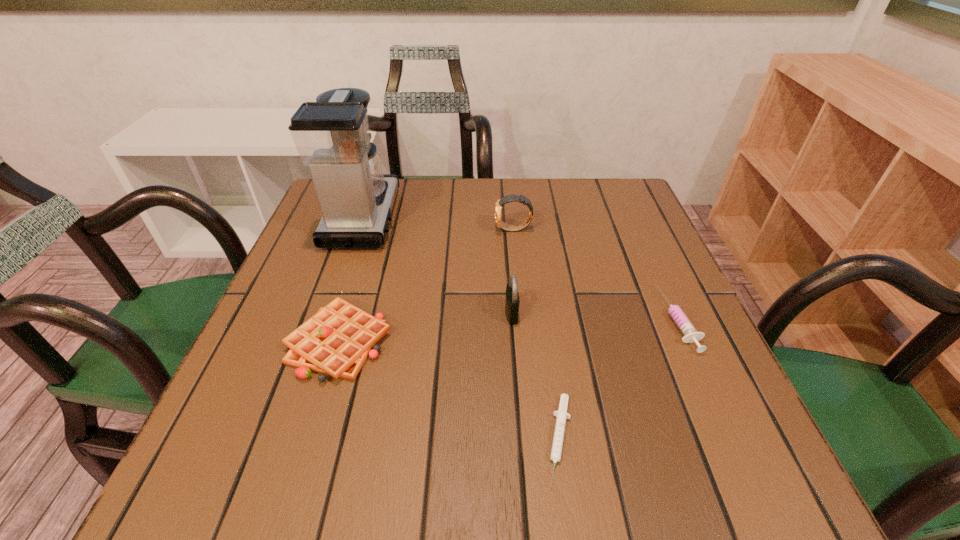
Where is `free space located 0.240m on the face of the watch`? This screenshot has width=960, height=540. free space located 0.240m on the face of the watch is located at coordinates (395, 230).

Locate an element on the screen. This screenshot has width=960, height=540. free location located 0.360m on the face of the watch is located at coordinates (344, 230).

Identify the location of free location located on the face of the watch. The width and height of the screenshot is (960, 540). coord(432,230).

Identify the location of vacant space located 0.110m on the front of the fourth tallest object. (306, 450).

The width and height of the screenshot is (960, 540). Identify the location of vacant space located 0.070m on the left of the fifth tallest object. (631, 320).

I want to click on vacant region located on the back of the nearer syringe, so click(x=548, y=358).

This screenshot has height=540, width=960. I want to click on coffee maker located at the far edge, so pos(331,135).

This screenshot has width=960, height=540. I want to click on watch that is at the far edge, so click(x=502, y=225).

This screenshot has width=960, height=540. Identify the location of object at the near edge. (561, 414).

You are a GUI agent. You are given a task and a screenshot of the screen. Output one action in this format:
    pyautogui.click(x=<x>, y=<y>)
    Task: Click on the coffee maker present at the left edge
    Image resolution: width=960 pixels, height=540 pixels.
    Given the screenshot: What is the action you would take?
    pyautogui.click(x=331, y=135)